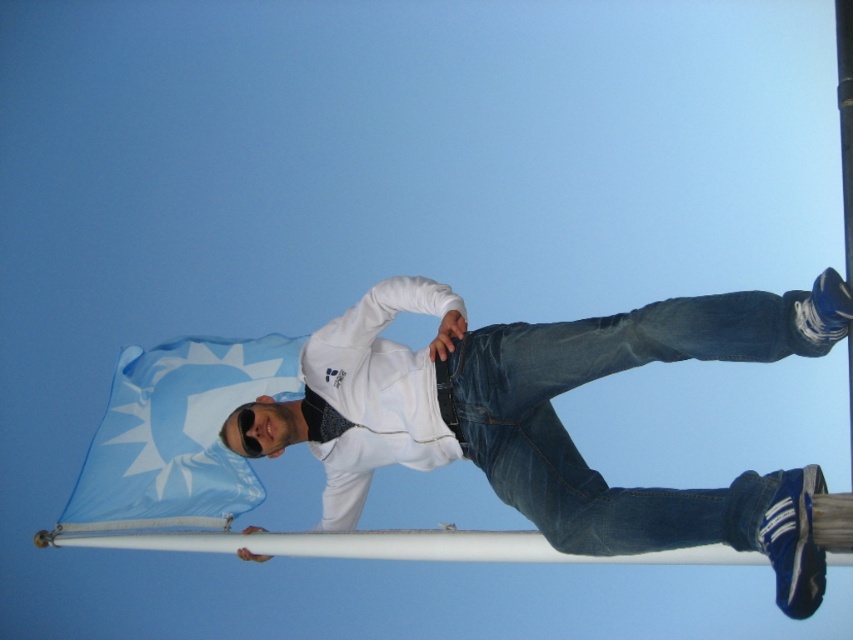
You are a photographer trying to capture the white matte hoodie at center and the blue fabric flag at upper left in a single frame. Which object should you focus on first if you want to ensure both are in focus without adjusting the camera settings?

The white matte hoodie at center is bigger than the blue fabric flag at upper left, so focusing on the larger object first will help ensure both are in focus.

You are a photographer trying to capture the person in the scene. Since the white matte hoodie at center and the blue fabric flag at upper left are both in the frame, which object takes up more horizontal space in the image?

The white matte hoodie at center takes up more horizontal space than the blue fabric flag at upper left because its width is larger.

You are a photographer setting up a shot of the person in the scene. The denim at center is part of their clothing. To ensure the blue fabric flag at upper left is visible in the background, should you adjust the camera angle to look up or down?

The denim at center is above the blue fabric flag at upper left, so to have the flag visible in the background behind the denim, the photographer should angle the camera downward to capture the flag below the denim.